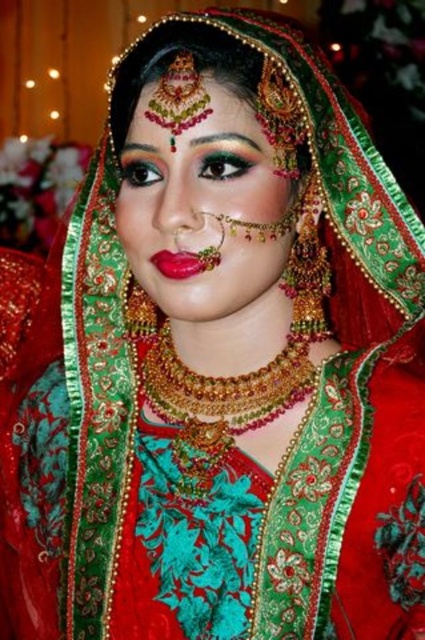
Can you confirm if matte gold jewelry at center is taller than shiny red lipstick at center?

Indeed, matte gold jewelry at center has a greater height compared to shiny red lipstick at center.

Does matte gold jewelry at center appear under shiny red lipstick at center?

No.

Measure the distance between matte gold jewelry at center and camera.

They are 33.70 inches apart.

Locate an element on the screen. This screenshot has width=425, height=640. matte gold jewelry at center is located at coordinates (201, 196).